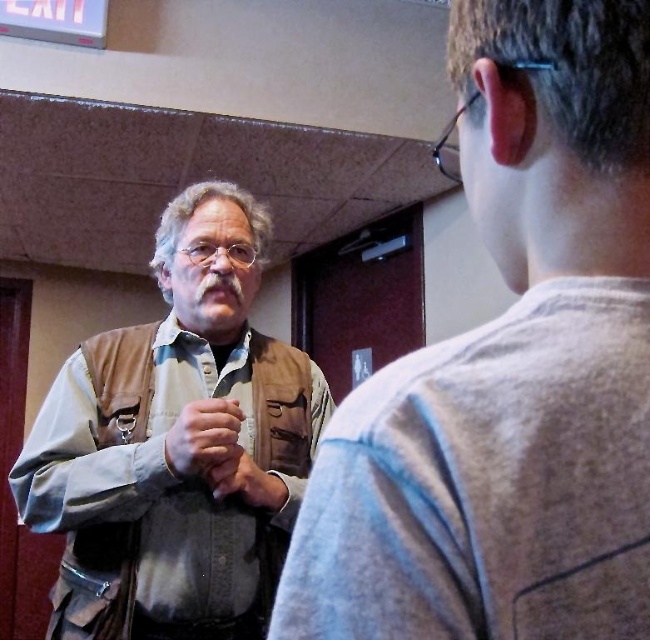
You are standing in the hallway and need to locate the matte brown vest at center. According to the coordinates provided, where would you find it?

The matte brown vest at center is located at coordinates point (203,436).

You are a fashion designer analyzing the clothing in the image. You need to determine which item is taller between the leather jacket at left and the matte brown vest at center. Based on the scene, which one has a greater height?

The leather jacket at left has a greater height compared to the matte brown vest at center.